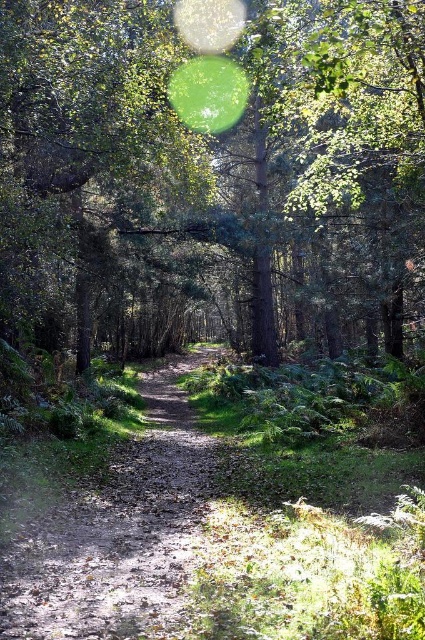
Who is more distant from viewer, [2,13] or [102,573]?

Point [2,13]

Who is more distant from viewer, (8,104) or (164,465)?

Point (164,465)

Identify the location of green leafy tree at center. This screenshot has width=425, height=640. (209, 164).